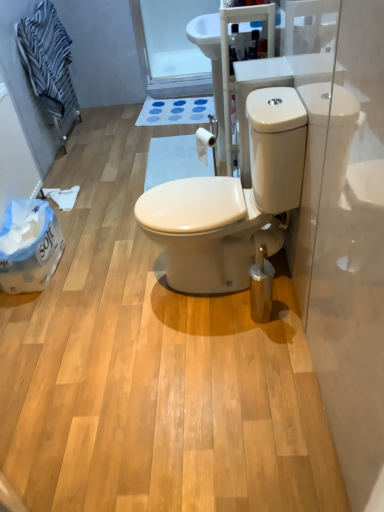
Where is `free space between white glossy toilet at center and white plastic bag at left`? free space between white glossy toilet at center and white plastic bag at left is located at coordinates (100, 271).